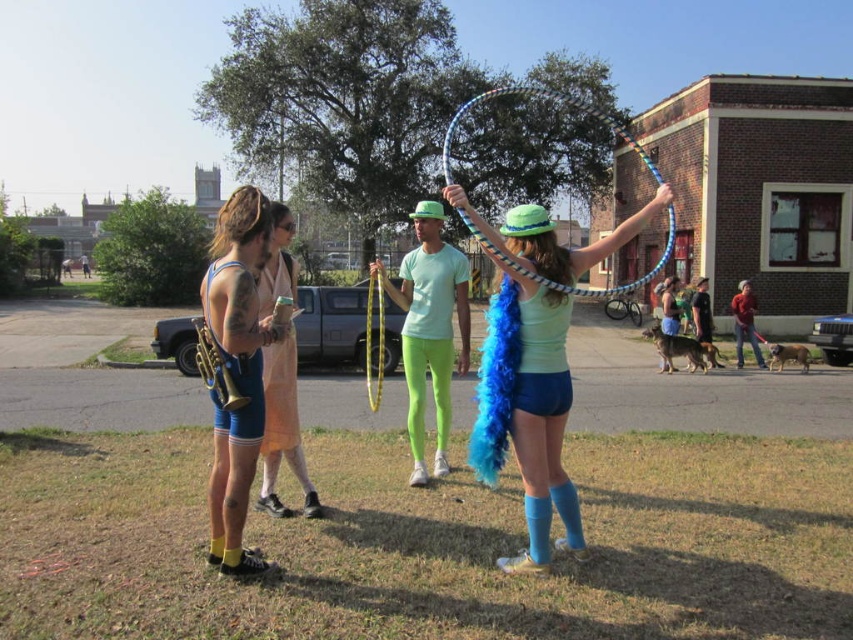
Does blue feather boa at center appear on the left side of red fabric jacket at center?

Indeed, blue feather boa at center is positioned on the left side of red fabric jacket at center.

In the scene shown: Does blue feather boa at center come in front of red fabric jacket at center?

Yes.

Does point (245, 307) come in front of point (735, 339)?

Yes, it is in front of point (735, 339).

This screenshot has width=853, height=640. I want to click on blue feather boa at center, so click(x=236, y=369).

Does matte blue feather boa at center have a lesser width compared to blue feather boa at center?

In fact, matte blue feather boa at center might be wider than blue feather boa at center.

Does matte blue feather boa at center appear over blue feather boa at center?

Answer: Actually, matte blue feather boa at center is below blue feather boa at center.

This screenshot has height=640, width=853. I want to click on matte blue feather boa at center, so click(527, 410).

Looking at this image, can you confirm if neon green leggings at center is smaller than red fabric jacket at center?

No, neon green leggings at center is not smaller than red fabric jacket at center.

Is neon green leggings at center wider than red fabric jacket at center?

Yes.

Is point (407, 371) less distant than point (741, 317)?

That is True.

Locate an element on the screen. This screenshot has width=853, height=640. neon green leggings at center is located at coordinates (428, 330).